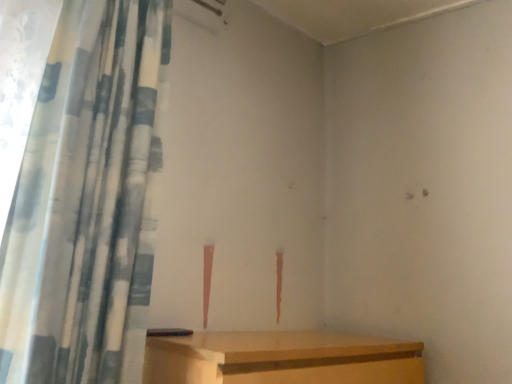
What do you see at coordinates (87, 199) in the screenshot? I see `white sheer curtain at left` at bounding box center [87, 199].

Where is `white sheer curtain at left`? The height and width of the screenshot is (384, 512). white sheer curtain at left is located at coordinates (87, 199).

Identify the location of white sheer curtain at left. (87, 199).